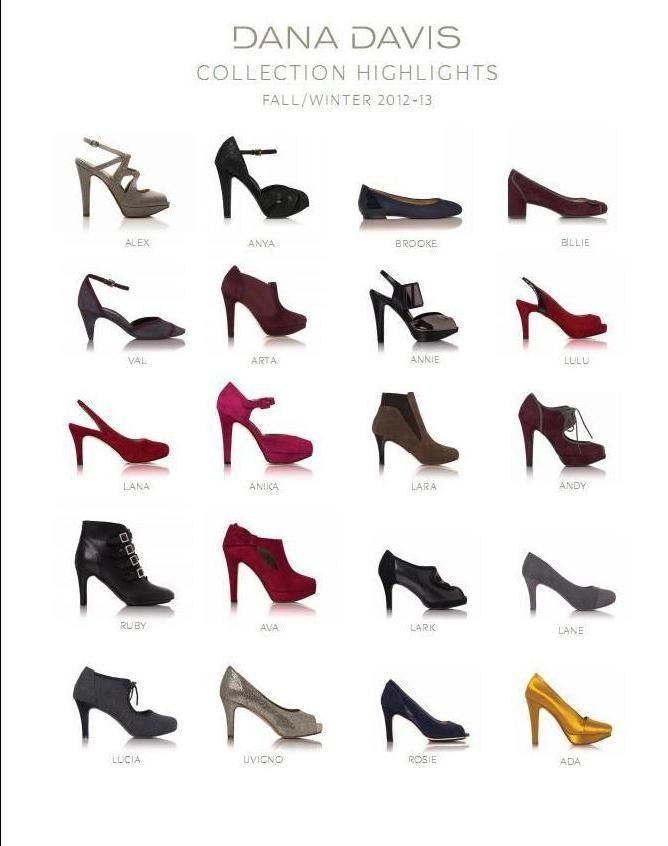
The image size is (668, 846). I want to click on all of the shoes in a vertical column on the left side, so click(x=135, y=195), click(x=145, y=325), click(x=136, y=445), click(x=140, y=588), click(x=138, y=715).